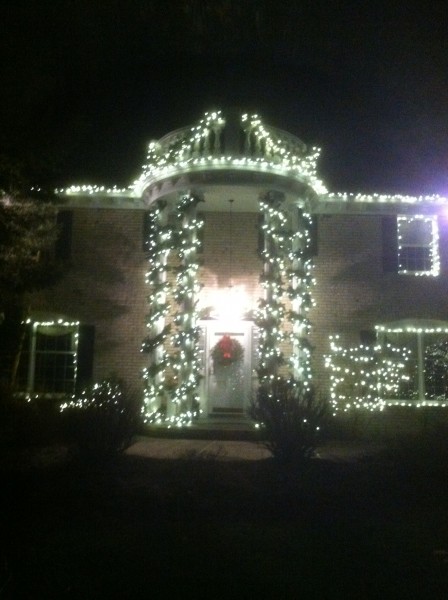
In order to click on christmas lights on column in this screenshot , I will do `click(158, 366)`, `click(182, 355)`, `click(267, 364)`, `click(307, 367)`.